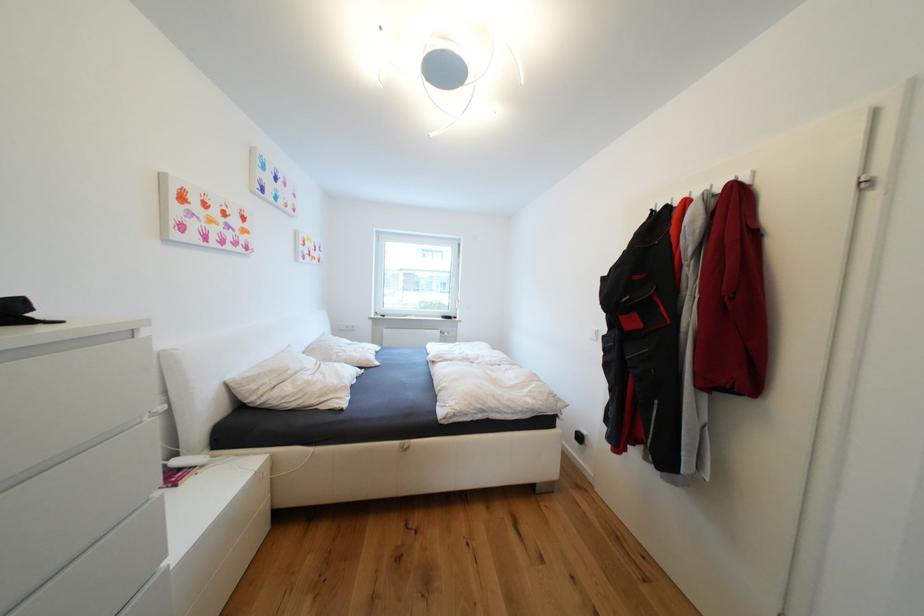
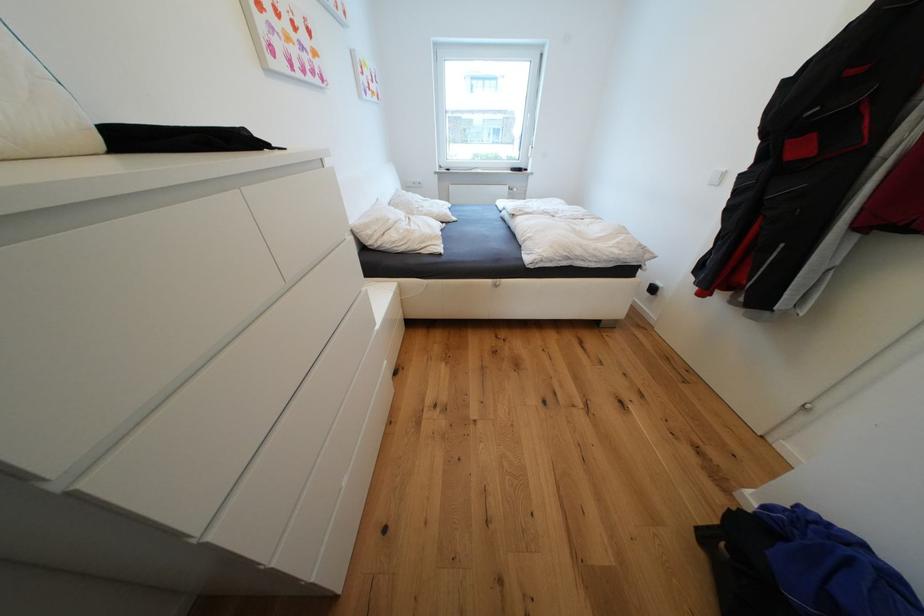
Question: How did the camera likely rotate?

Choices:
 (A) Left
 (B) Right
 (C) Up
 (D) Down

Answer: (D)